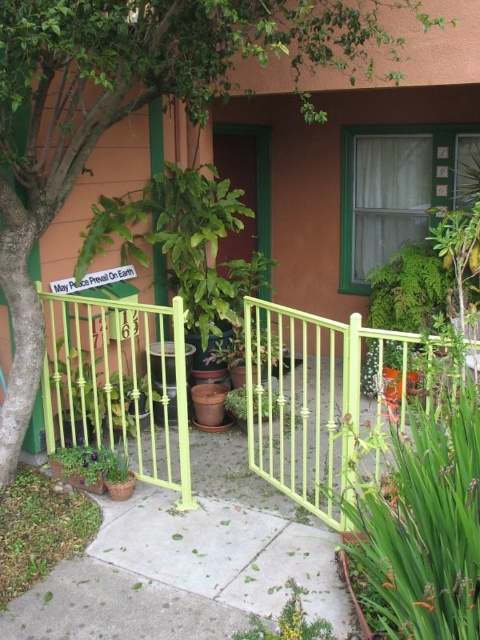
Which is behind, point (108, 504) or point (468, 568)?

The point (108, 504) is behind.

Between point (109, 557) and point (420, 531), which one is positioned in front?

Positioned in front is point (420, 531).

Find the location of a particular element. The height and width of the screenshot is (640, 480). gray concrete pavement at center is located at coordinates (182, 573).

Who is positioned more to the right, green leafy tree at center or light green metal gate at center?

From the viewer's perspective, light green metal gate at center appears more on the right side.

Does green leafy tree at center have a larger size compared to light green metal gate at center?

Correct, green leafy tree at center is larger in size than light green metal gate at center.

Locate an element on the screen. green leafy tree at center is located at coordinates (131, 108).

Where is `green leafy tree at center`? green leafy tree at center is located at coordinates click(x=131, y=108).

Which is behind, point (289, 534) or point (277, 621)?

Point (289, 534)

Does gray concrete pavement at center have a larger size compared to green leafy plant at lower right?

Correct, gray concrete pavement at center is larger in size than green leafy plant at lower right.

Is point (278, 522) farther from camera compared to point (271, 636)?

Yes, it is behind point (271, 636).

Identify the location of gray concrete pavement at center. (182, 573).